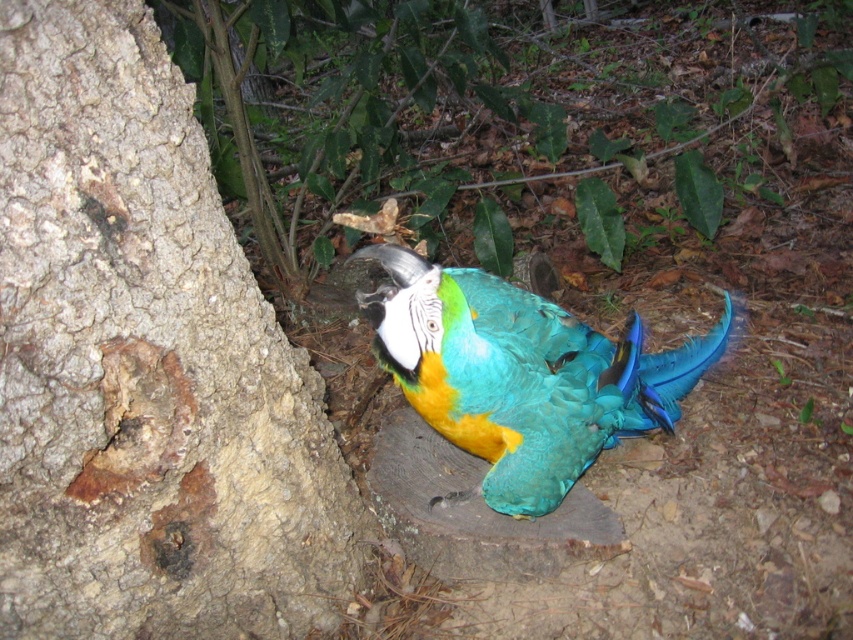
Measure the distance between rough bark tree trunk at left and shiny teal parrot at center.

They are 13.35 inches apart.

Does rough bark tree trunk at left have a greater height compared to shiny teal parrot at center?

Correct, rough bark tree trunk at left is much taller as shiny teal parrot at center.

The image size is (853, 640). Find the location of `rough bark tree trunk at left`. rough bark tree trunk at left is located at coordinates (x=144, y=364).